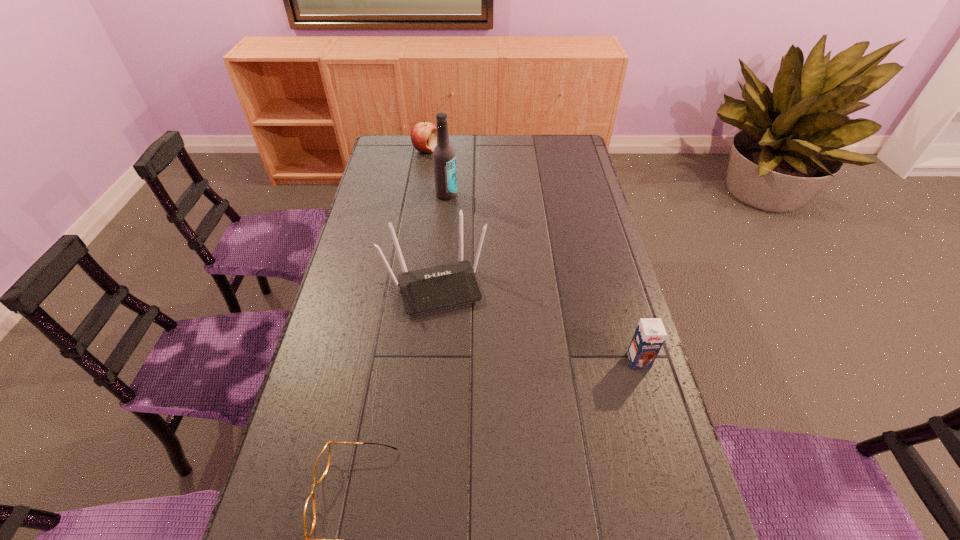
Find the location of `free space located on the label of the tallest object`. free space located on the label of the tallest object is located at coordinates (468, 238).

In order to click on free space located 0.230m on the label of the tallest object in this screenshot , I will do `click(468, 238)`.

The image size is (960, 540). In order to click on vacant region located on the bitten side of the apple in this screenshot , I will do `click(440, 183)`.

This screenshot has height=540, width=960. I want to click on vacant space situated 0.320m on the bitten side of the apple, so click(447, 199).

The image size is (960, 540). I want to click on vacant area situated 0.070m on the bitten side of the apple, so click(432, 166).

I want to click on vacant space positioned 0.090m on the front-facing side of the third nearest object, so click(x=455, y=341).

This screenshot has height=540, width=960. What are the coordinates of `free region located on the front-facing side of the third nearest object` in the screenshot? It's located at (453, 336).

Locate an element on the screen. The width and height of the screenshot is (960, 540). vacant area situated 0.380m on the front-facing side of the third nearest object is located at coordinates (484, 438).

Find the location of a particular element. The width and height of the screenshot is (960, 540). object at the far edge is located at coordinates (423, 135).

This screenshot has height=540, width=960. I want to click on apple that is at the left edge, so click(423, 135).